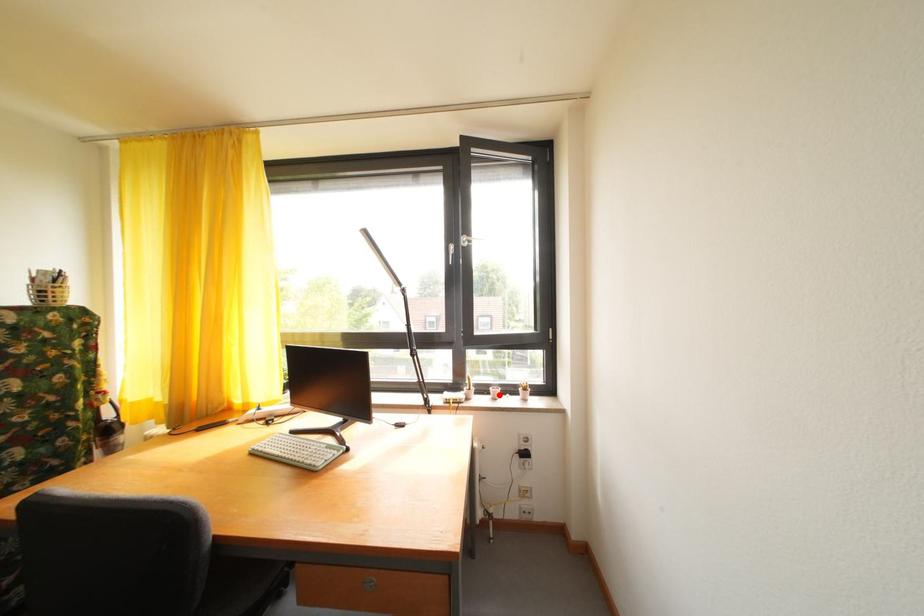
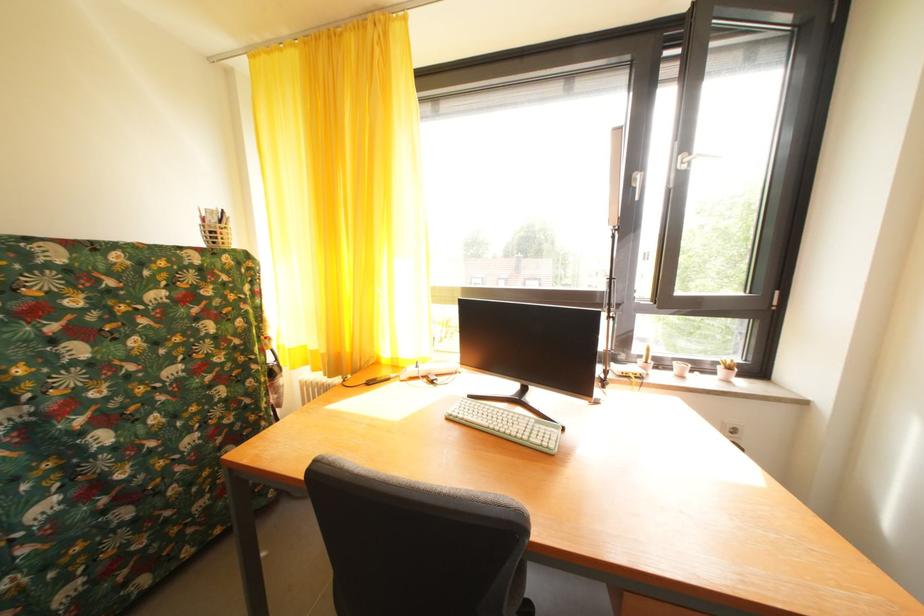
In the second image, find the point that corresponds to the highlighted location in the first image.

(685, 370)